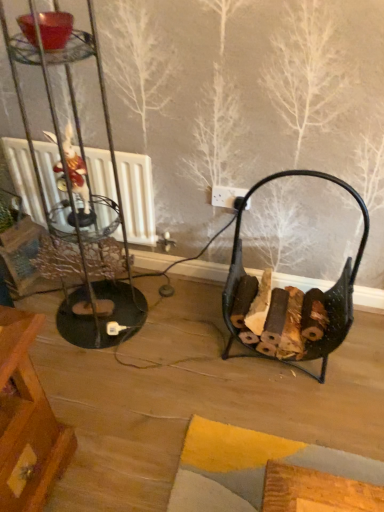
At what (x,y) coordinates should I click in order to perform the action: click on vacant region to the left of black metal firewood basket at lower right. Please return your answer as a coordinate pair (x, y). Looking at the image, I should click on (185, 342).